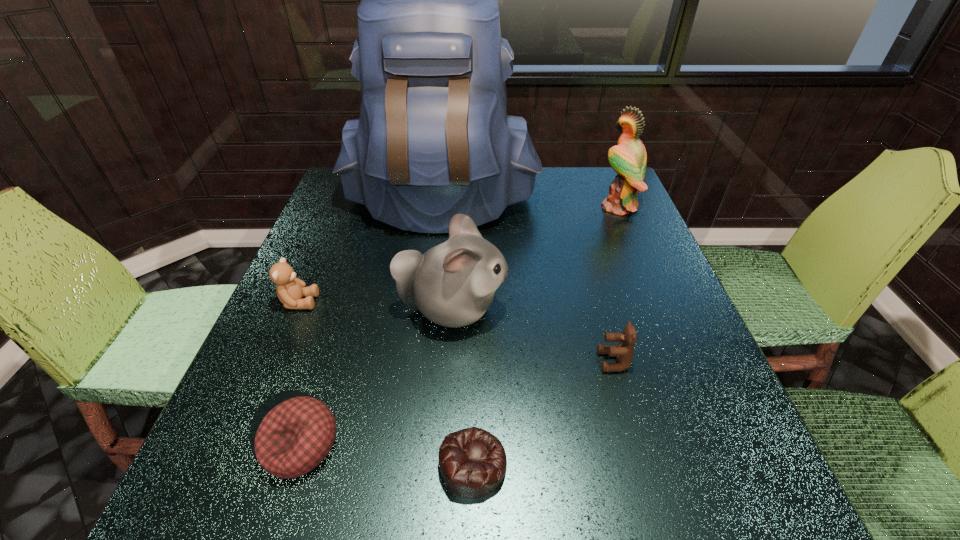
At what (x,y) coordinates should I click in order to perform the action: click on backpack. Please return your answer as a coordinate pair (x, y). Looking at the image, I should click on click(433, 139).

You are a GUI agent. You are given a task and a screenshot of the screen. Output one action in this format:
    pyautogui.click(x=<x>, y=<y>)
    Task: Click on the sixth shortest object
    
    Given the screenshot: What is the action you would take?
    pyautogui.click(x=628, y=158)

Where is `parrot`? The height and width of the screenshot is (540, 960). parrot is located at coordinates (628, 158).

Image resolution: width=960 pixels, height=540 pixels. What are the coordinates of `the third tallest object` in the screenshot? It's located at (452, 284).

You are a GUI agent. You are given a task and a screenshot of the screen. Output one action in this format:
    pyautogui.click(x=<x>, y=<y>)
    Task: Click on the farther teddy bear
    The width and height of the screenshot is (960, 540).
    Given the screenshot: What is the action you would take?
    pyautogui.click(x=290, y=290)

At what (x,y) coordinates should I click in order to perform the action: click on the nearer teddy bear. Please return your answer as a coordinate pair (x, y). Looking at the image, I should click on (624, 351).

Image resolution: width=960 pixels, height=540 pixels. I want to click on the third nearest object, so click(624, 351).

This screenshot has width=960, height=540. Find the location of `the second shortest object`. the second shortest object is located at coordinates (294, 437).

Where is `the left beanbag`? The width and height of the screenshot is (960, 540). the left beanbag is located at coordinates (294, 437).

Identify the location of the shorter beanbag. (472, 461).